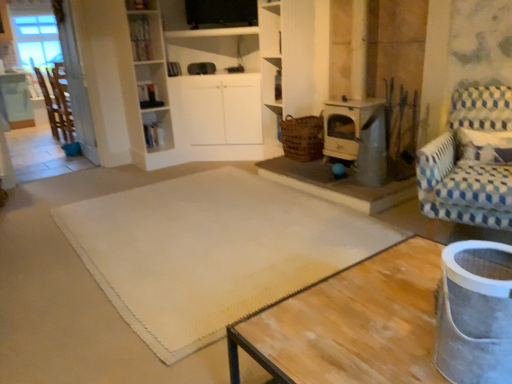
Question: Would you say white glossy bookshelf at upper center is to the left or to the right of white textured mat at center in the picture?

Choices:
 (A) left
 (B) right

Answer: (A)

Question: Considering the positions of white glossy bookshelf at upper center and white textured mat at center in the image, is white glossy bookshelf at upper center taller or shorter than white textured mat at center?

Choices:
 (A) tall
 (B) short

Answer: (A)

Question: Considering the real-world distances, which object is farthest from the white textured mat at center?

Choices:
 (A) wooden chair at left, which is counted as the first chair, starting from the left
 (B) brushed metal table at left
 (C) white glossy bookshelf at upper center
 (D) brown woven basket at center-right
 (E) metallic stove at center-right

Answer: (B)

Question: Which object is the farthest from the wooden chair at left, which appears as the 2th chair when ordered from the bottom?

Choices:
 (A) white glossy bookshelf at upper center
 (B) white textured mat at center
 (C) brown woven basket at center-right
 (D) brushed metal table at left
 (E) blue and white checkered fabric armchair at right, acting as the 2th chair starting from the back

Answer: (E)